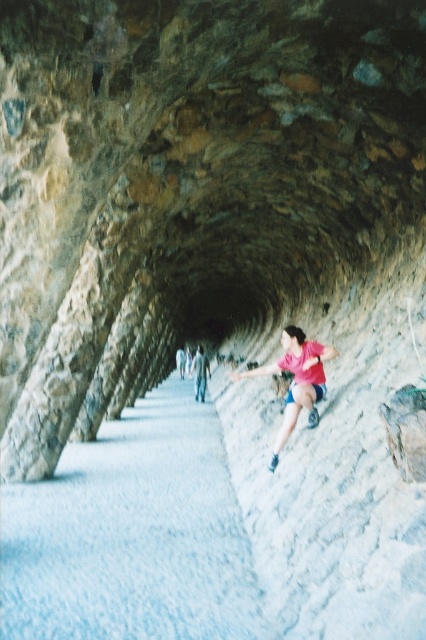
You are navigating through the tunnel and want to reach the exit. You notice two points marked on the path. Which point is closer to the tunnel exit? The points are point (307, 358) and point (204, 372).

Point (307, 358) is in front of point (204, 372), so it is closer to the tunnel exit.

You are standing at the entrance of the tunnel and see the point marked at coordinates (296, 380). Based on the scene description, what object is located at this point?

The point at coordinates (296, 380) is located on the pink fabric shorts at center.